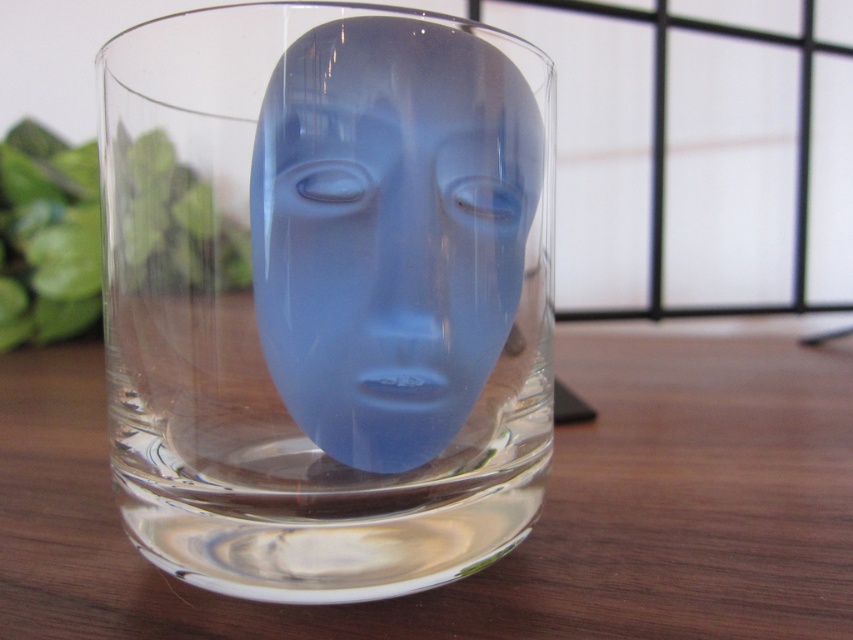
Between transparent glass mask at center and satin blue mask at center, which one is positioned higher?

satin blue mask at center is higher up.

Between transparent glass mask at center and satin blue mask at center, which one appears on the left side from the viewer's perspective?

transparent glass mask at center is more to the left.

Is point (286, 512) positioned after point (309, 177)?

Yes, point (286, 512) is behind point (309, 177).

You are a GUI agent. You are given a task and a screenshot of the screen. Output one action in this format:
    pyautogui.click(x=<x>, y=<y>)
    Task: Click on the transparent glass mask at center
    
    Given the screenshot: What is the action you would take?
    pyautogui.click(x=326, y=296)

Is point (280, 200) positioned after point (766, 536)?

No, (280, 200) is in front of (766, 536).

Measure the distance between transparent glass mask at center and camera.

13.07 centimeters

Measure the distance between transparent glass mask at center and camera.

5.15 inches

The width and height of the screenshot is (853, 640). I want to click on transparent glass mask at center, so click(x=326, y=296).

Is wooden table at center wider than satin blue mask at center?

Correct, the width of wooden table at center exceeds that of satin blue mask at center.

Can you confirm if wooden table at center is smaller than satin blue mask at center?

No.

Does point (778, 556) lie in front of point (393, 237)?

That is False.

The width and height of the screenshot is (853, 640). What are the coordinates of `wooden table at center` in the screenshot? It's located at (534, 524).